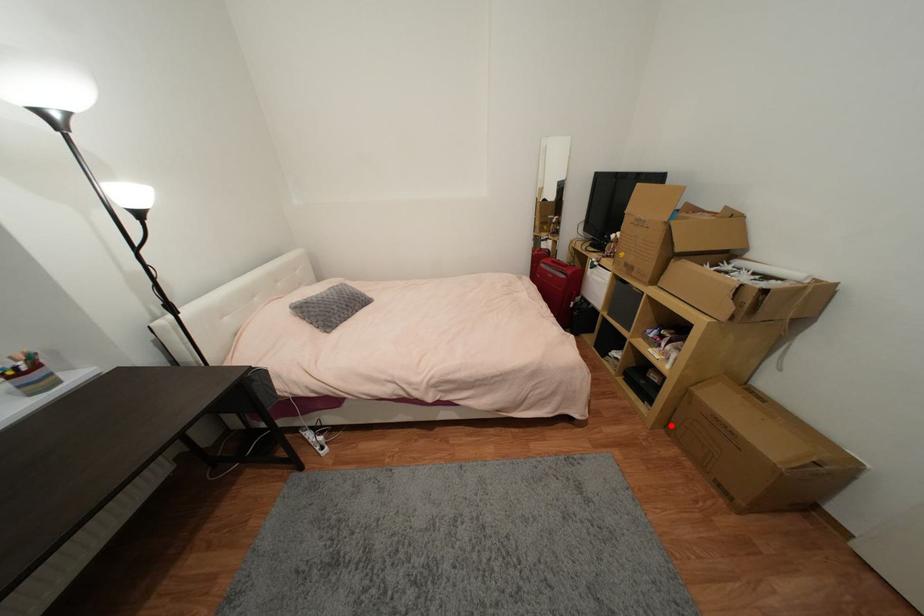
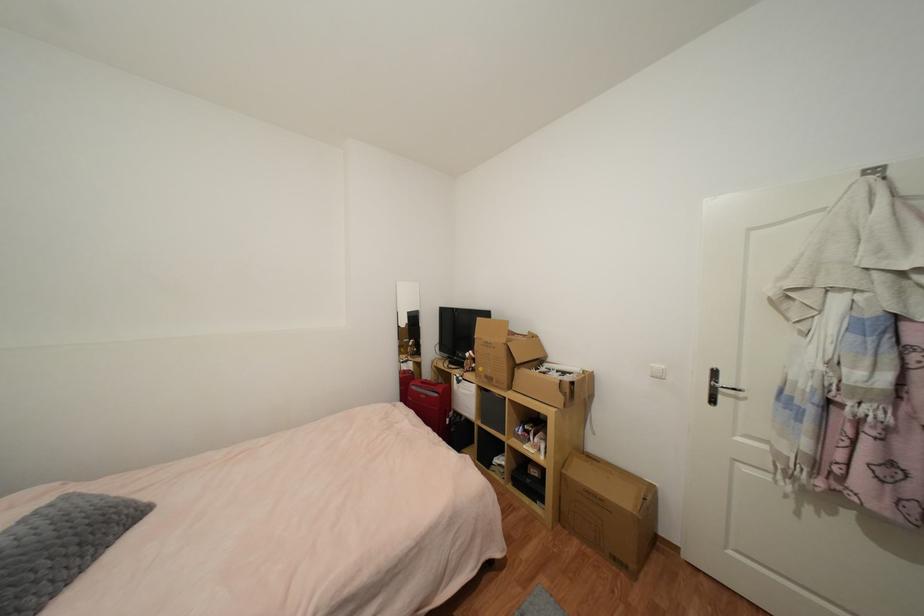
Locate, in the second image, the point that corresponds to the highlighted location in the first image.

(564, 517)